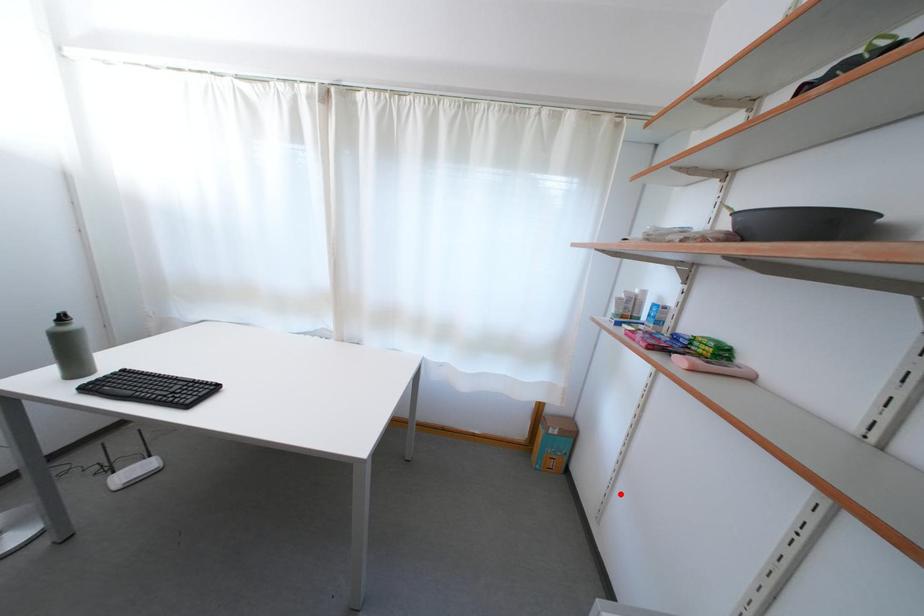
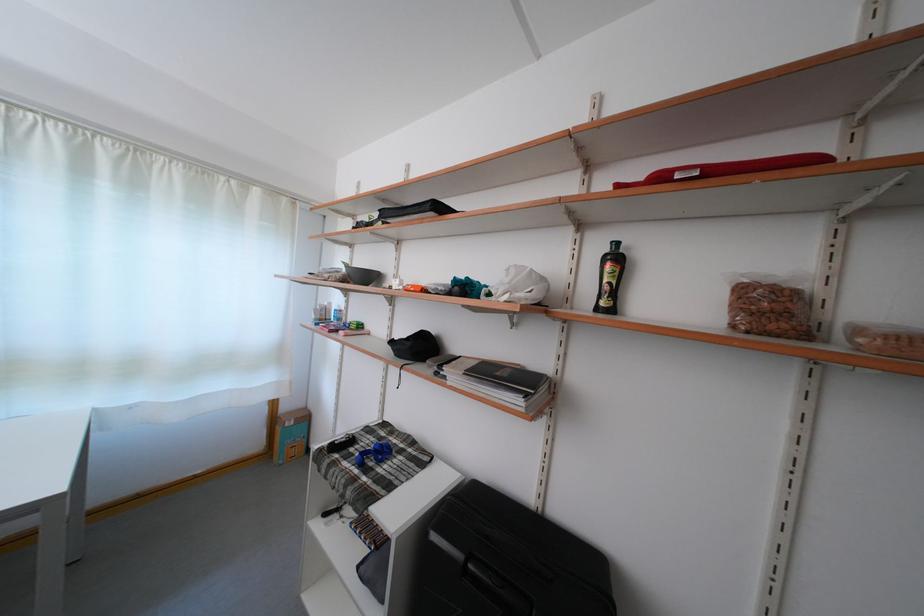
Question: I am providing you with two images of the same scene from different viewpoints. Given a red point in image1, look at the same physical point in image2. Is it:

Choices:
 (A) Closer to the viewpoint
 (B) Farther from the viewpoint

Answer: (B)